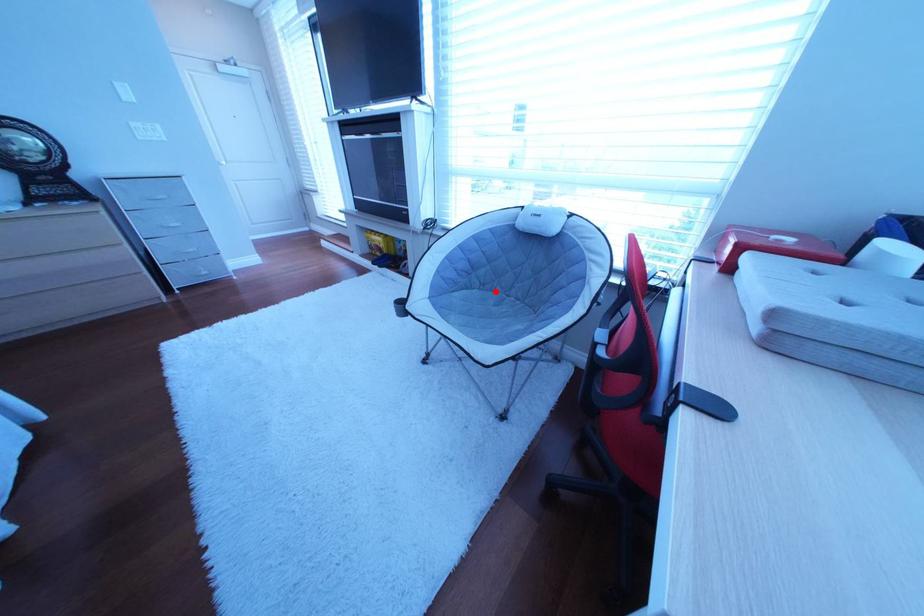
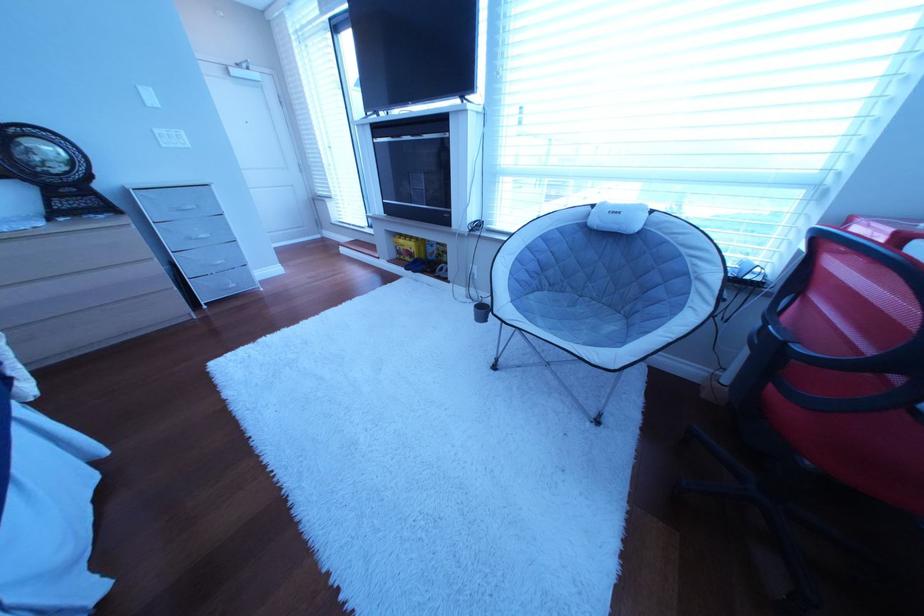
Where in the second image is the point corresponding to the highlighted location from the first image?

(565, 293)